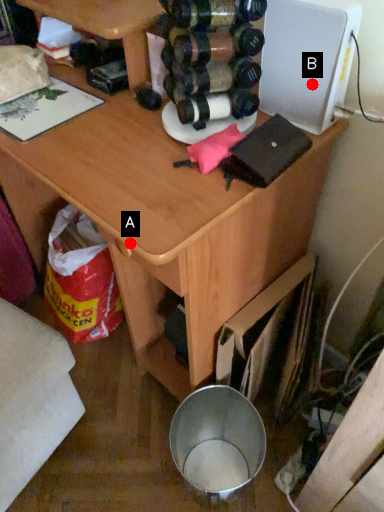
Question: Two points are circled on the image, labeled by A and B beside each circle. Which of the following is the farthest from the observer?

Choices:
 (A) A is further
 (B) B is further

Answer: (B)